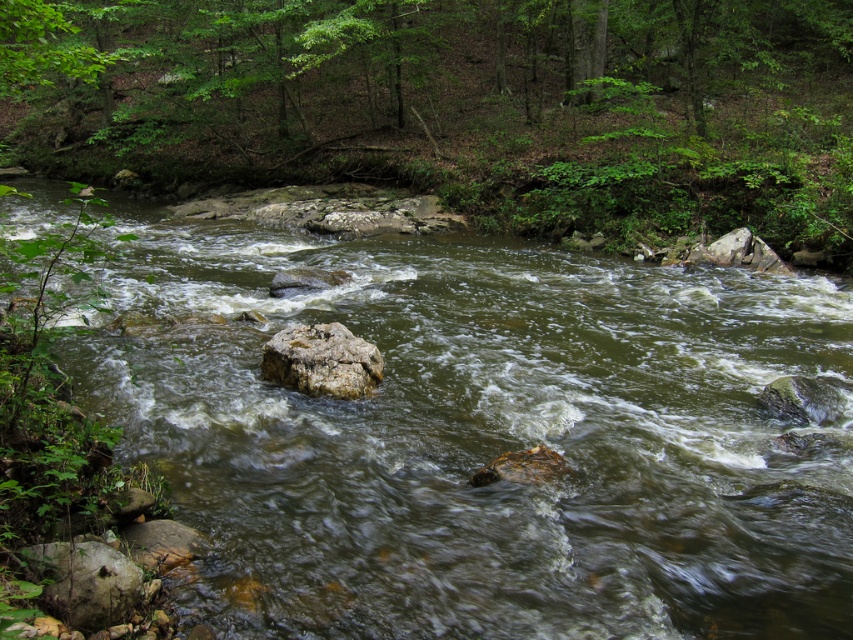
You are a hiker who wants to cross the river using the rocks. The green mossy rock at center and rough textured rock at center are the only two rocks in the river. Your backpack is 1.5 meters wide. Can you safely cross the river by stepping on these rocks without your backpack getting wet?

The green mossy rock at center and rough textured rock at center are 1.62 meters apart. Since your backpack is 1.5 meters wide, you can safely cross the river by stepping on these rocks as the distance between them is greater than the backpack width, allowing you to navigate without the backpack getting wet.

You are a hiker trying to cross the river using the green mossy rock at center and the green leafy tree at upper center as landmarks. Which landmark should you aim for first to reach the opposite bank safely?

You should aim for the green mossy rock at center first since it is closer to you than the green leafy tree at upper center, making it easier to reach safely.